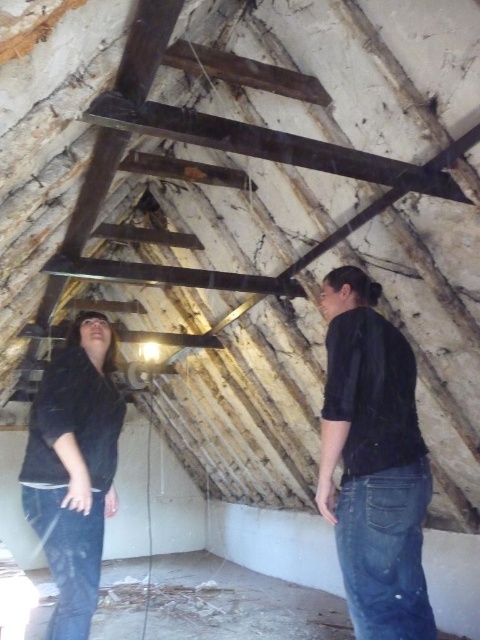
You are organizing a photo shoot in this attic and need to position two models. One is wearing a black matte shirt at center and the other a black matte jacket at lower left. According to the scene, where should each model stand relative to each other?

The black matte shirt at center should be positioned to the right of the black matte jacket at lower left.

Consider the image. You are a fashion designer observing the two black matte garments in the attic scene. You need to decide if they can be displayed side by side on a mannequin stand that is 36 inches wide. Can both the black matte shirt at center and the black matte jacket at lower left fit on the stand without overlapping?

The black matte shirt at center and the black matte jacket at lower left are 38.02 inches apart, which is wider than the 36 inch stand. Therefore, they cannot fit side by side without overlapping.

You are organizing a clothing donation drive and need to determine if the black matte shirt at center can be placed on top of the black matte jacket at lower left. Based on their positions in the image, is this possible?

The black matte shirt at center is above the black matte jacket at lower left, so it is already positioned on top of the jacket. Therefore, placing it there would be possible.